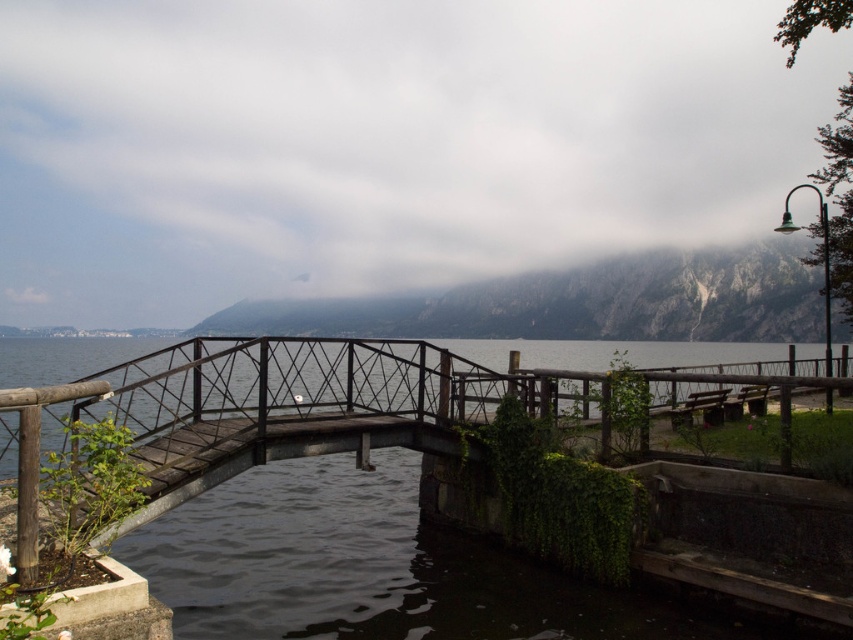
Question: Which point is closer to the camera?

Choices:
 (A) rocky gray mountain at upper center
 (B) rusty metal bridge at center

Answer: (B)

Question: Is rusty metal bridge at center further to camera compared to rocky gray mountain at upper center?

Choices:
 (A) yes
 (B) no

Answer: (B)

Question: Which point is closer to the camera taking this photo?

Choices:
 (A) (390, 417)
 (B) (560, 339)

Answer: (A)

Question: Is rusty metal bridge at center positioned behind rocky gray mountain at upper center?

Choices:
 (A) yes
 (B) no

Answer: (B)

Question: Among these objects, which one is nearest to the camera?

Choices:
 (A) rusty metal bridge at center
 (B) rocky gray mountain at upper center

Answer: (A)

Question: Can you confirm if rusty metal bridge at center is wider than rocky gray mountain at upper center?

Choices:
 (A) no
 (B) yes

Answer: (A)